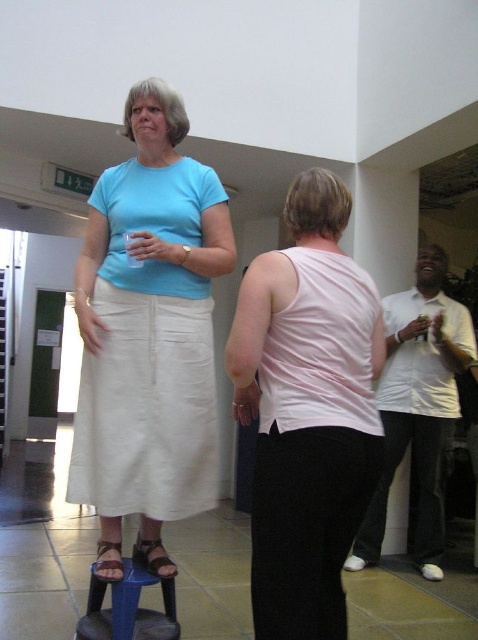
Is matte cotton skirt at center positioned behind leather sandal at lower center?

No.

Is matte cotton skirt at center thinner than leather sandal at lower center?

No.

Who is more forward, (91, 461) or (154, 561)?

Point (91, 461) is more forward.

Identify the location of matte cotton skirt at center. The width and height of the screenshot is (478, 640). (149, 326).

Is pink fabric tank top at center thinner than blue fabric stool at lower left?

No, pink fabric tank top at center is not thinner than blue fabric stool at lower left.

Between pink fabric tank top at center and blue fabric stool at lower left, which one appears on the left side from the viewer's perspective?

From the viewer's perspective, blue fabric stool at lower left appears more on the left side.

Does point (340, 627) come behind point (101, 625)?

That is False.

At what (x,y) coordinates should I click in order to perform the action: click on pink fabric tank top at center. Please return your answer as a coordinate pair (x, y). Looking at the image, I should click on (306, 412).

Which of these two, matte cotton skirt at center or white matte cup at right, stands shorter?

matte cotton skirt at center is shorter.

The width and height of the screenshot is (478, 640). What do you see at coordinates (149, 326) in the screenshot?
I see `matte cotton skirt at center` at bounding box center [149, 326].

At what (x,y) coordinates should I click in order to perform the action: click on matte cotton skirt at center. Please return your answer as a coordinate pair (x, y). Looking at the image, I should click on (149, 326).